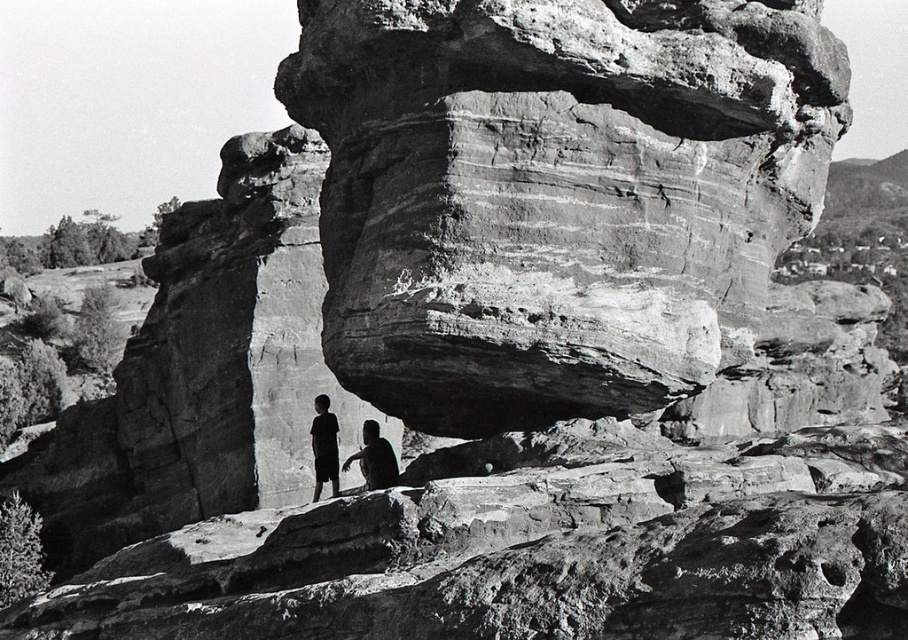
Question: Considering the real-world distances, which object is closest to the dark skin textured person at lower center?

Choices:
 (A) dark clothing figure at center
 (B) dark skin textured shirt at center
 (C) rugged stone arch at center

Answer: (A)

Question: Is rugged stone arch at center wider than dark skin textured person at lower center?

Choices:
 (A) no
 (B) yes

Answer: (B)

Question: Estimate the real-world distances between objects in this image. Which object is farther from the dark skin textured shirt at center?

Choices:
 (A) dark skin textured person at lower center
 (B) rugged stone arch at center

Answer: (B)

Question: Considering the real-world distances, which object is farthest from the dark skin textured person at lower center?

Choices:
 (A) dark skin textured shirt at center
 (B) dark clothing figure at center
 (C) rugged stone arch at center

Answer: (C)

Question: Can you confirm if rugged stone arch at center is thinner than dark clothing figure at center?

Choices:
 (A) yes
 (B) no

Answer: (B)

Question: Can you confirm if dark clothing figure at center is positioned above dark skin textured person at lower center?

Choices:
 (A) no
 (B) yes

Answer: (A)